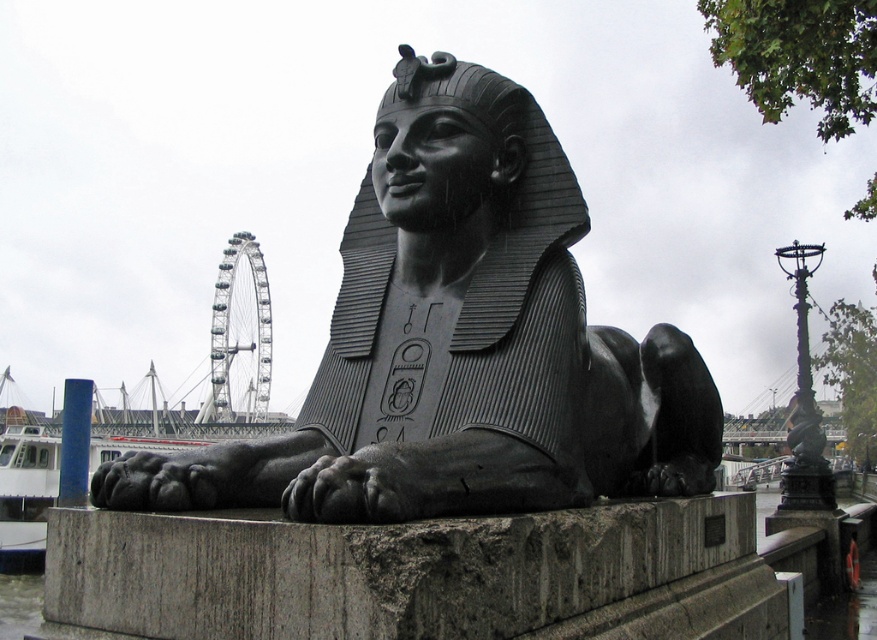
Question: Is black polished stone sphinx at center bigger than gray stone pedestal at lower center?

Choices:
 (A) no
 (B) yes

Answer: (A)

Question: Among these points, which one is farthest from the camera?

Choices:
 (A) (84, 628)
 (B) (662, 404)

Answer: (B)

Question: Does black polished stone sphinx at center have a lesser width compared to gray stone pedestal at lower center?

Choices:
 (A) no
 (B) yes

Answer: (B)

Question: Can you confirm if black polished stone sphinx at center is positioned below gray stone pedestal at lower center?

Choices:
 (A) no
 (B) yes

Answer: (A)

Question: Which point is farther from the camera taking this photo?

Choices:
 (A) (628, 452)
 (B) (265, 636)

Answer: (A)